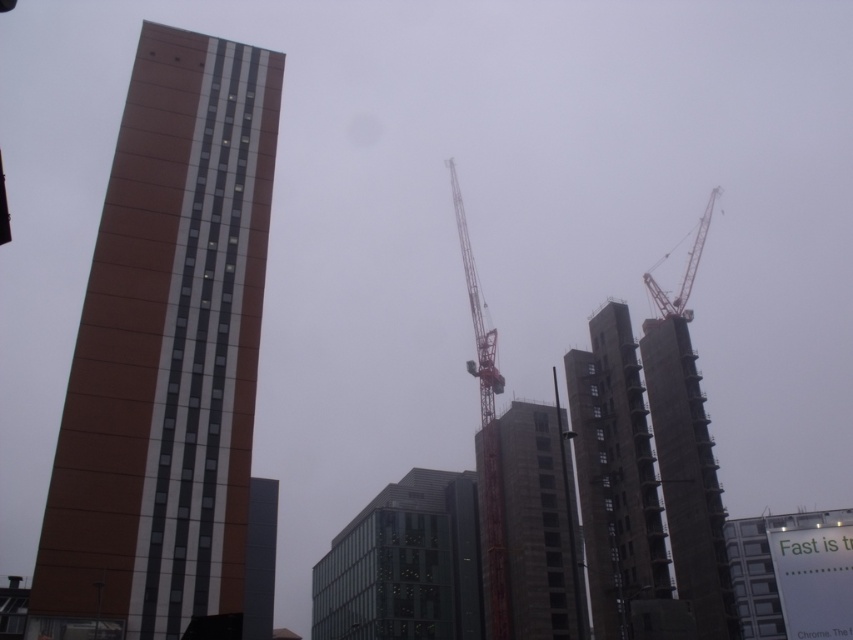
Based on the scene description, what does the point at coordinates (614, 474) indicate?

The point at coordinates (614, 474) marks the location of the dark gray concrete building at center.

You are standing at the center of the image and want to take a photo of the brown textured building at left. Which direction should you face to capture it in your camera view?

You should face to the left to capture the brown textured building at left since it is located at the left side of the image.

You are standing in the middle of the urban area and see the gray concrete building at center and the dark gray concrete tower at center. Which one is positioned more to the east?

The gray concrete building at center is positioned to the right of the dark gray concrete tower at center, so if you are facing north, the gray concrete building at center is more to the east.